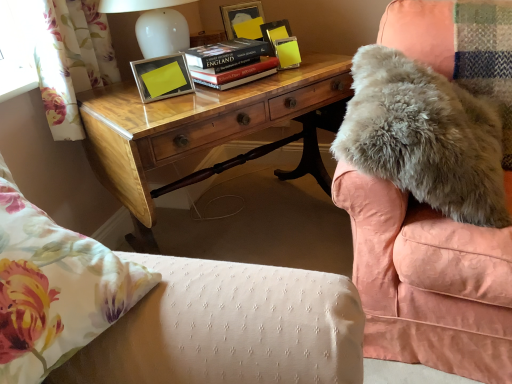
You are a GUI agent. You are given a task and a screenshot of the screen. Output one action in this format:
    pyautogui.click(x=<x>, y=<y>)
    Task: Click on the empty space that is to the right of metallic yellow picture frame at upper center
    The width and height of the screenshot is (512, 384).
    Given the screenshot: What is the action you would take?
    pyautogui.click(x=222, y=96)